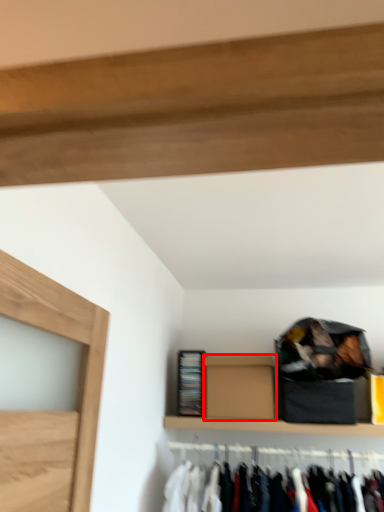
Question: Observing the image, what is the correct spatial positioning of box (annotated by the red box) in reference to cabinet?

Choices:
 (A) right
 (B) left

Answer: (A)